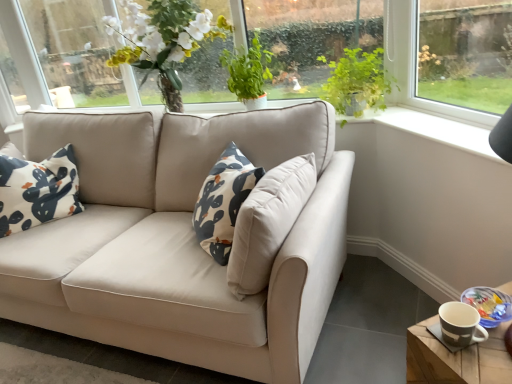
Question: Is matte brown mug at lower right aimed at green leafy plant at upper center, positioned as the second plant in right-to-left order?

Choices:
 (A) no
 (B) yes

Answer: (A)

Question: Is matte brown mug at lower right behind green leafy plant at upper center, marked as the first plant in a left-to-right arrangement?

Choices:
 (A) yes
 (B) no

Answer: (B)

Question: Is green leafy plant at upper center, positioned as the second plant in right-to-left order, at the back of matte brown mug at lower right?

Choices:
 (A) no
 (B) yes

Answer: (A)

Question: From a real-world perspective, is matte brown mug at lower right over green leafy plant at upper center, positioned as the second plant in right-to-left order?

Choices:
 (A) yes
 (B) no

Answer: (B)

Question: Is matte brown mug at lower right at the left side of green leafy plant at upper center, positioned as the second plant in right-to-left order?

Choices:
 (A) yes
 (B) no

Answer: (B)

Question: Is matte brown mug at lower right closer to camera compared to green leafy plant at upper center, positioned as the second plant in right-to-left order?

Choices:
 (A) yes
 (B) no

Answer: (A)

Question: From the image's perspective, is green leafy plant at upper center, marked as the first plant in a left-to-right arrangement, below matte brown mug at lower right?

Choices:
 (A) no
 (B) yes

Answer: (A)

Question: From a real-world perspective, is green leafy plant at upper center, marked as the first plant in a left-to-right arrangement, over matte brown mug at lower right?

Choices:
 (A) no
 (B) yes

Answer: (B)

Question: Considering the relative positions of green leafy plant at upper center, marked as the first plant in a left-to-right arrangement, and matte brown mug at lower right in the image provided, is green leafy plant at upper center, marked as the first plant in a left-to-right arrangement, in front of matte brown mug at lower right?

Choices:
 (A) no
 (B) yes

Answer: (A)

Question: Does green leafy plant at upper center, marked as the first plant in a left-to-right arrangement, have a greater width compared to matte brown mug at lower right?

Choices:
 (A) no
 (B) yes

Answer: (B)

Question: Does green leafy plant at upper center, positioned as the second plant in right-to-left order, lie behind matte brown mug at lower right?

Choices:
 (A) yes
 (B) no

Answer: (A)

Question: From a real-world perspective, is green leafy plant at upper center, positioned as the second plant in right-to-left order, beneath matte brown mug at lower right?

Choices:
 (A) no
 (B) yes

Answer: (A)

Question: Is wooden coaster at lower right placed right next to matte brown mug at lower right?

Choices:
 (A) no
 (B) yes

Answer: (B)